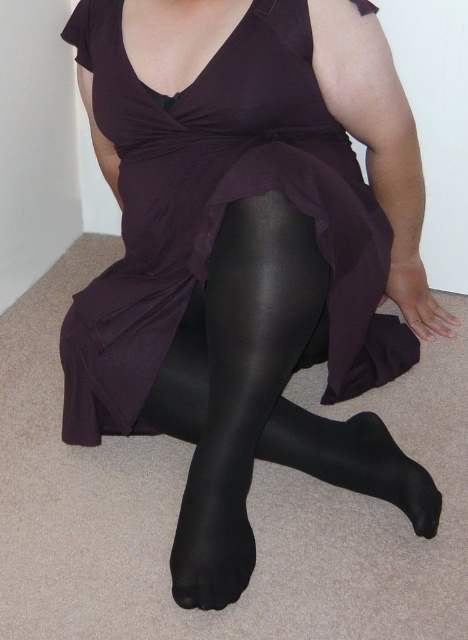
Question: Which of the following is the closest to the observer?

Choices:
 (A) (355, 438)
 (B) (343, 451)
 (C) (269, 22)

Answer: (C)

Question: Is matte purple dress at center smaller than black satin sock at lower center?

Choices:
 (A) no
 (B) yes

Answer: (A)

Question: Which of these objects is positioned farthest from the shiny black tights at center?

Choices:
 (A) black satin sock at lower center
 (B) matte purple dress at center

Answer: (B)

Question: Which of the following is the farthest from the observer?

Choices:
 (A) shiny black tights at center
 (B) black satin sock at lower center
 (C) matte purple dress at center

Answer: (B)

Question: Is shiny black tights at center smaller than black satin sock at lower center?

Choices:
 (A) no
 (B) yes

Answer: (A)

Question: Can you confirm if matte purple dress at center is thinner than black satin sock at lower center?

Choices:
 (A) yes
 (B) no

Answer: (B)